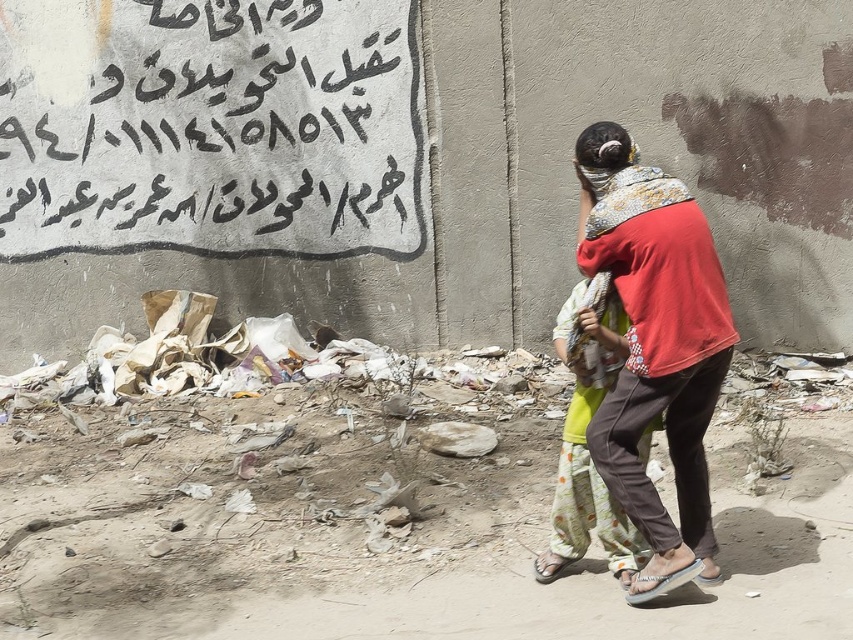
You are a drone operator trying to capture a photo of the red cotton shirt at center. The camera has a 10 foot range. Will you be able to capture the black painted text at upper left in the same photo?

The distance between the black painted text at upper left and the red cotton shirt at center is 10.99 feet, which is slightly beyond the camera range of 10 feet. Therefore, the black painted text at upper left will not be captured in the same photo as the red cotton shirt at center.

You are a photographer trying to capture both the black painted text at upper left and the red cotton shirt at center in a single frame. Which object should you focus on first to ensure both are in focus?

You should focus on the black painted text at upper left first because it is closer to you than the red cotton shirt at center, so focusing on the closer object will help both be in focus.

You are a photographer trying to capture the red cotton shirt at center and the black painted text at upper left in the same frame. Can you adjust your camera angle so that both objects are visible without moving either object?

The black painted text at upper left is located above the red cotton shirt at center, so by angling the camera upwards, you can include both the black painted text at upper left and the red cotton shirt at center in the same frame.